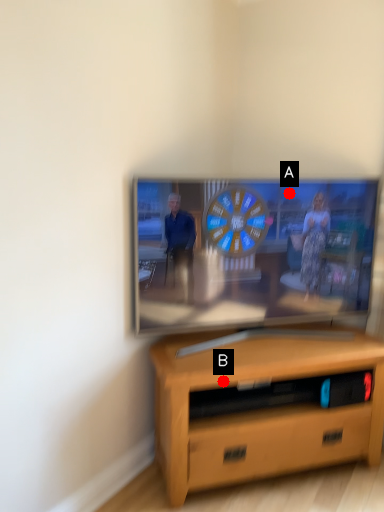
Question: Two points are circled on the image, labeled by A and B beside each circle. Which point is closer to the camera?

Choices:
 (A) A is closer
 (B) B is closer

Answer: (B)